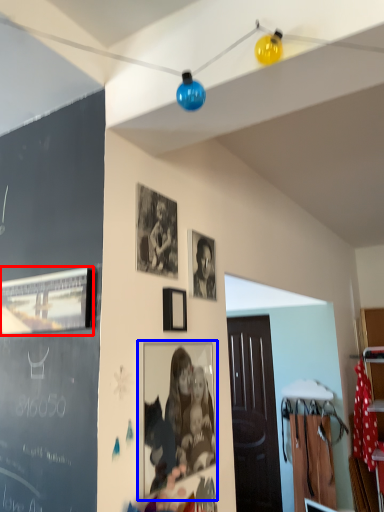
Question: Which of the following is the farthest to the observer, picture frame (highlighted by a red box) or picture frame (highlighted by a blue box)?

Choices:
 (A) picture frame
 (B) picture frame

Answer: (B)